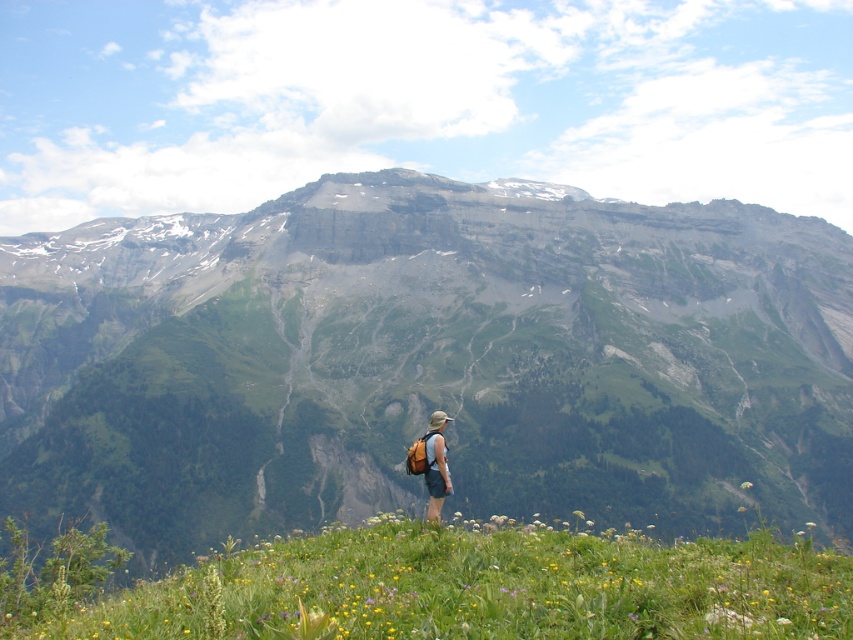
You are a photographer trying to capture the matte khaki shorts at center and the green matte flower at lower right in the same frame. Since the shorts are narrower than the flower, which object should you zoom in on to ensure both fit in the photo?

The matte khaki shorts at center is narrower than the green matte flower at lower right, so you should zoom out to include both objects in the frame.

You are a hiker who wants to take a photo of the green grassy hillside at lower center while standing on the matte khaki shorts at center. Which direction should you face to capture the hillside in your shot?

You should face to the left side since the green grassy hillside at lower center is positioned on the left side of the matte khaki shorts at center.

You are a photographer positioned at the edge of the meadow where the person is standing. You want to capture a photo that includes both the matte khaki shorts at center and the green matte flower at lower right. Which object should you focus on first to ensure both are in sharp focus?

You should focus on the matte khaki shorts at center first since it is closer to the viewer than the green matte flower at lower right. By focusing on the closer object, the depth of field may extend to include the flower in the background, ensuring both are sharp.